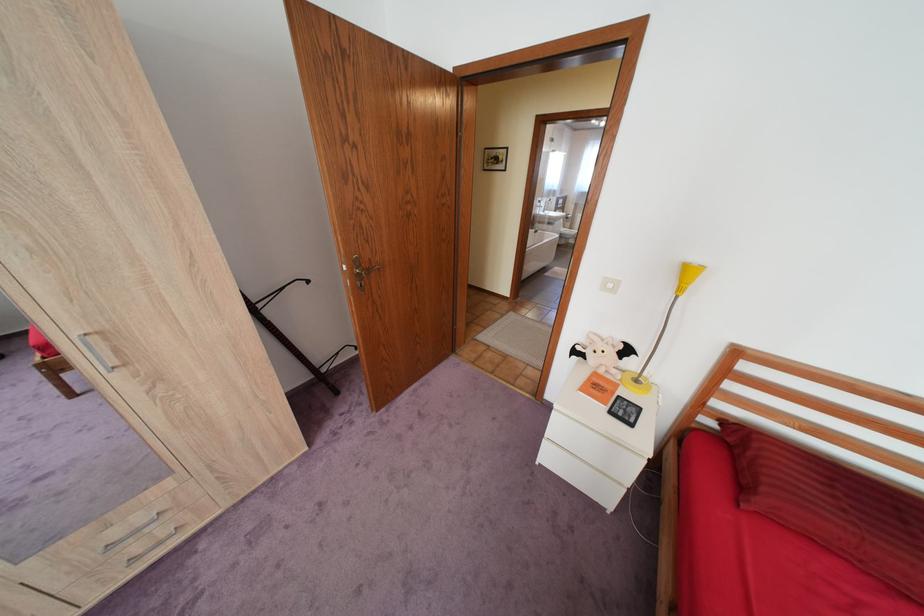
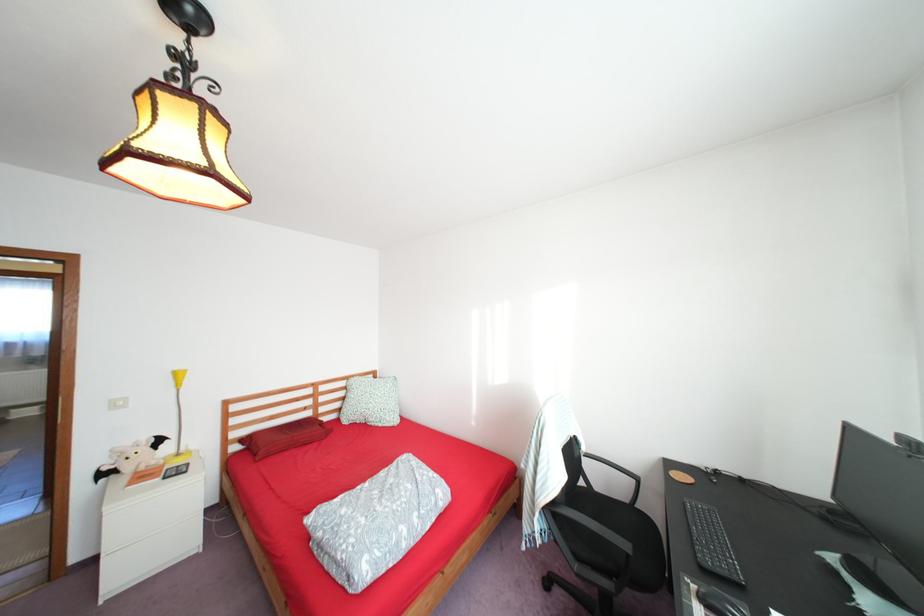
Where in the second image is the point corresponding to the point at 718,421 from the first image?

(246, 447)